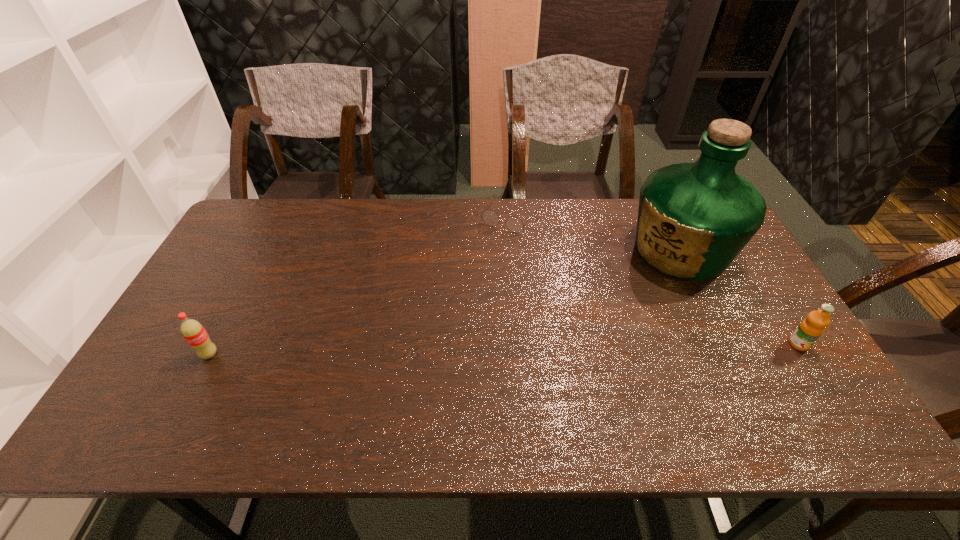
The image size is (960, 540). In order to click on vacant space that is in between the liquor and the soda in this screenshot , I will do `click(444, 303)`.

Find the location of a particular element. This screenshot has width=960, height=540. blank region between the leftmost object and the spectacles is located at coordinates (361, 286).

At what (x,y) coordinates should I click in order to perform the action: click on vacant point located between the third object from right to left and the orange juice. Please return your answer as a coordinate pair (x, y). This screenshot has width=960, height=540. Looking at the image, I should click on (656, 280).

You are a GUI agent. You are given a task and a screenshot of the screen. Output one action in this format:
    pyautogui.click(x=<x>, y=<y>)
    Task: Click on the free space between the soda and the orange juice
    Image resolution: width=960 pixels, height=540 pixels.
    Given the screenshot: What is the action you would take?
    pos(504,349)

I want to click on free space between the soda and the liquor, so click(x=444, y=303).

Identify which object is the second nearest to the orange juice. Please provide its 2D coordinates. Your answer should be formatted as a tuple, i.e. [(x, y)], where the tuple contains the x and y coordinates of a point satisfying the conditions above.

[(514, 224)]

Point out which object is positioned as the nearest to the orange juice. Please provide its 2D coordinates. Your answer should be formatted as a tuple, i.e. [(x, y)], where the tuple contains the x and y coordinates of a point satisfying the conditions above.

[(693, 220)]

At what (x,y) coordinates should I click in order to perform the action: click on free space that satisfies the following two spatial constraints: 1. on the front side of the spectacles; 2. on the left side of the liquor. Please return your answer as a coordinate pair (x, y). This screenshot has width=960, height=540. Looking at the image, I should click on (515, 251).

Locate an element on the screen. Image resolution: width=960 pixels, height=540 pixels. free space in the image that satisfies the following two spatial constraints: 1. on the back side of the second object from left to right; 2. on the right side of the soda is located at coordinates (281, 217).

Identify the location of free space that satisfies the following two spatial constraints: 1. on the back side of the leftmost object; 2. on the left side of the spectacles. Image resolution: width=960 pixels, height=540 pixels. click(281, 217).